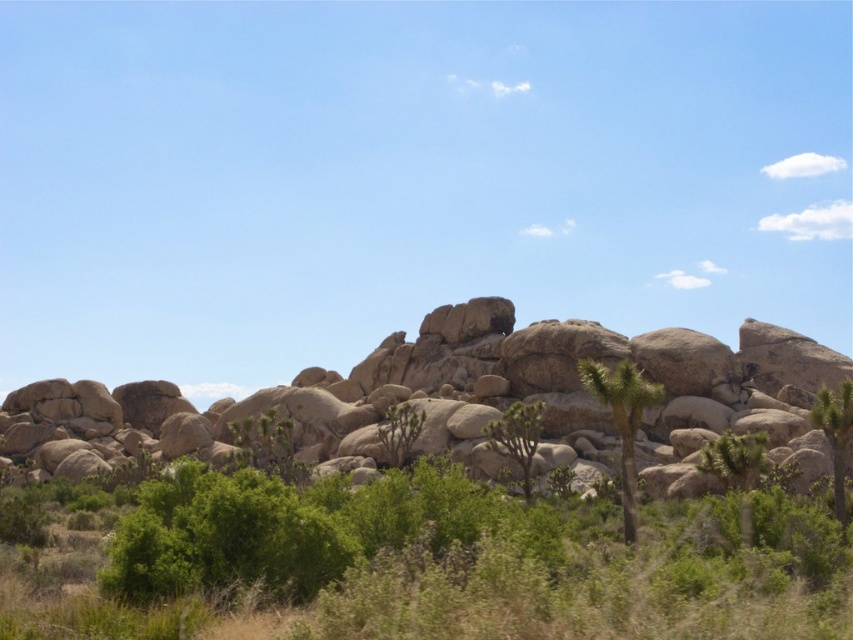
Question: Does green spiky cactus at center-right appear under green leafy shrub at center?

Choices:
 (A) no
 (B) yes

Answer: (A)

Question: Among these points, which one is farthest from the camera?

Choices:
 (A) (750, 545)
 (B) (752, 364)

Answer: (B)

Question: Among these objects, which one is farthest from the camera?

Choices:
 (A) green leafy shrub at center
 (B) green spiky tree at center
 (C) green leafy bush at center
 (D) green spiky cactus at center-right

Answer: (A)

Question: Is green spiky tree at center wider than green leafy tree at right?

Choices:
 (A) no
 (B) yes

Answer: (A)

Question: Considering the real-world distances, which object is closest to the green spiky cactus at center-right?

Choices:
 (A) green spiky tree at center
 (B) green leafy bush at center
 (C) green leafy shrub at center
 (D) beige rough rock formation at center

Answer: (A)

Question: Does green spiky tree at center appear under green leafy tree at right?

Choices:
 (A) yes
 (B) no

Answer: (B)